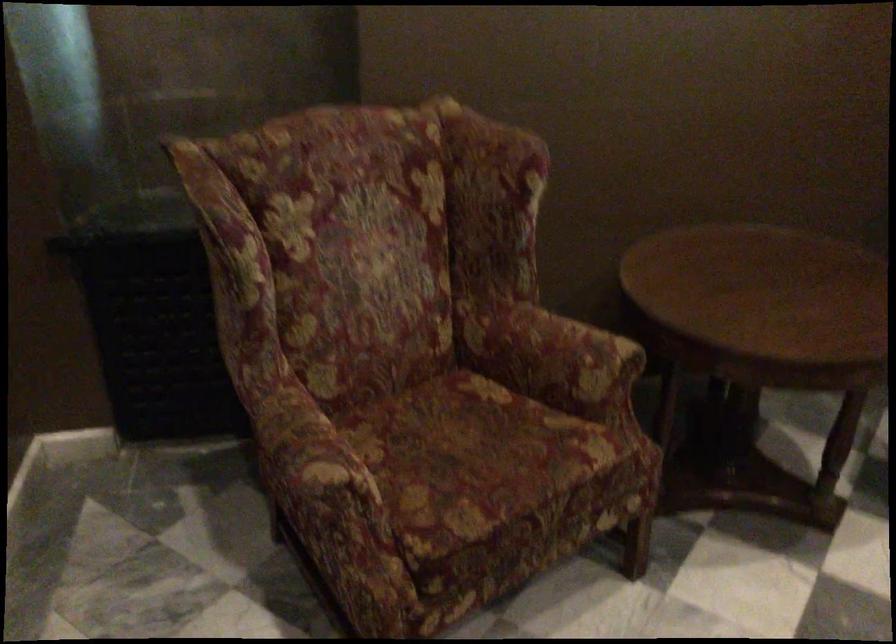
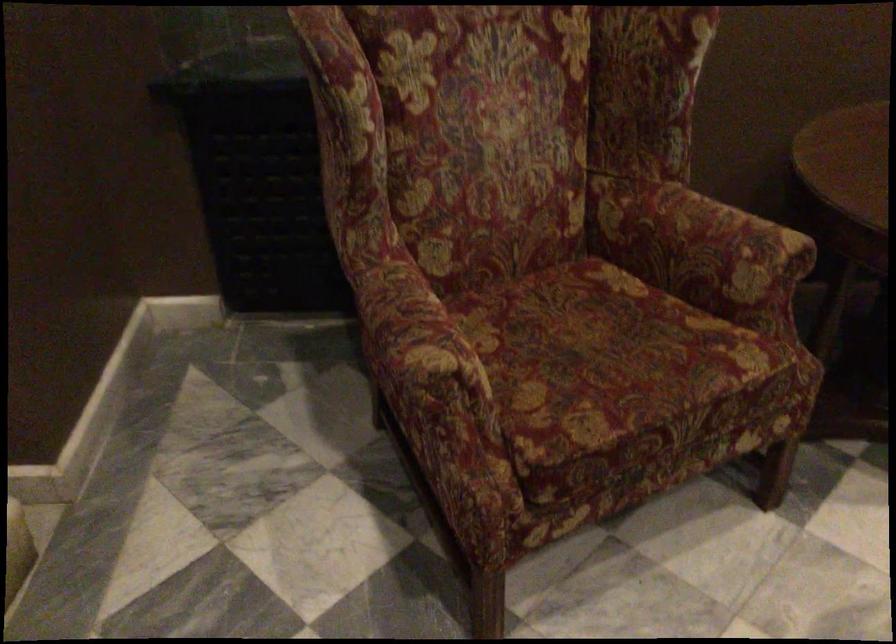
In the second image, find the point that corresponds to [479,460] in the first image.

(606, 361)